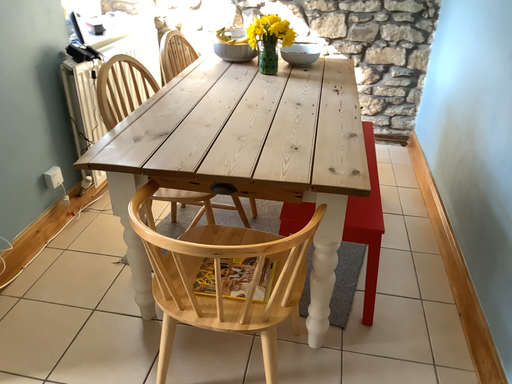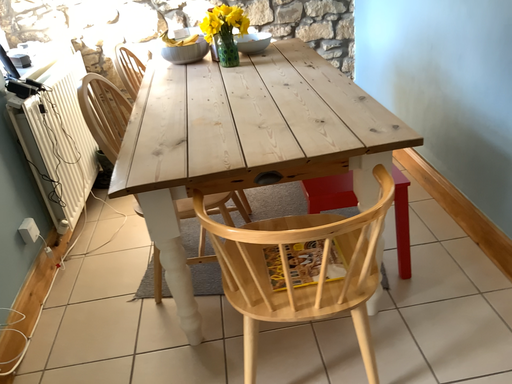
Question: How did the camera likely rotate when shooting the video?

Choices:
 (A) rotated right
 (B) rotated left

Answer: (A)